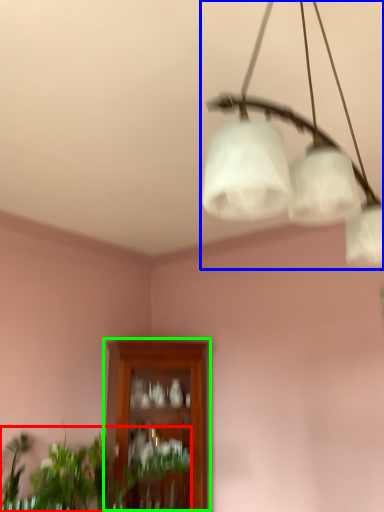
Question: Which object is the closest to the houseplant (highlighted by a red box)? Choose among these: lamp (highlighted by a blue box) or cabinetry (highlighted by a green box).

Choices:
 (A) lamp
 (B) cabinetry

Answer: (B)